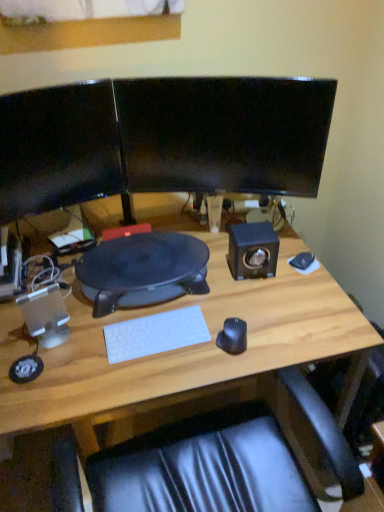
Where is `free point to the right of matte black speaker at right, the 2th speaker in the left-to-right sequence`? The height and width of the screenshot is (512, 384). free point to the right of matte black speaker at right, the 2th speaker in the left-to-right sequence is located at coordinates (299, 279).